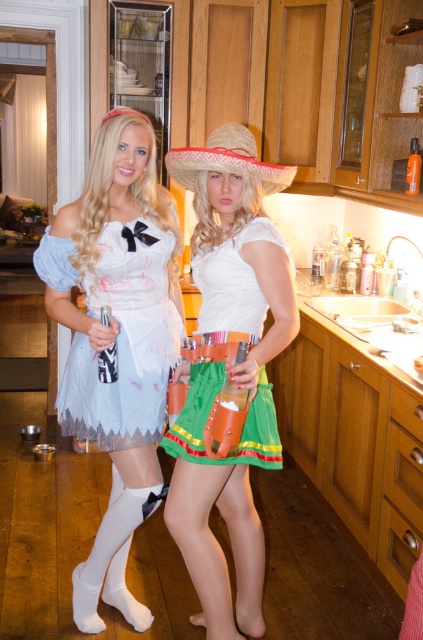
You are a photographer standing in a kitchen setting. You want to take a closeup photo of the green fabric skirt at center. The camera you are using has a minimum focusing distance of 1.5 meters. Can you take the photo without moving closer than 1.5 meters?

The green fabric skirt at center is 1.63 meters away from the camera. Since the minimum focusing distance is 1.5 meters, you can take the closeup photo without moving closer than 1.5 meters because the skirt is within the camera range.

You are designing a costume for a play and need to ensure the green fabric skirt at center and the straw hat at center are proportional. Based on the image, which object should be scaled down to maintain the correct proportions?

The green fabric skirt at center should be scaled down because it is currently larger in size than the straw hat at center, so reducing its size would help achieve proper proportions between the two elements.